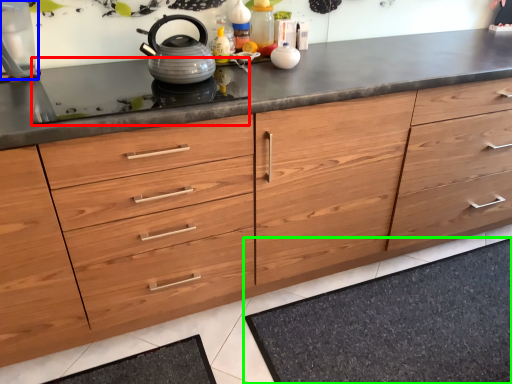
Question: Which object is positioned closest to gas stove (highlighted by a red box)? Select from appliance (highlighted by a blue box) and bath mat (highlighted by a green box).

Choices:
 (A) appliance
 (B) bath mat

Answer: (A)